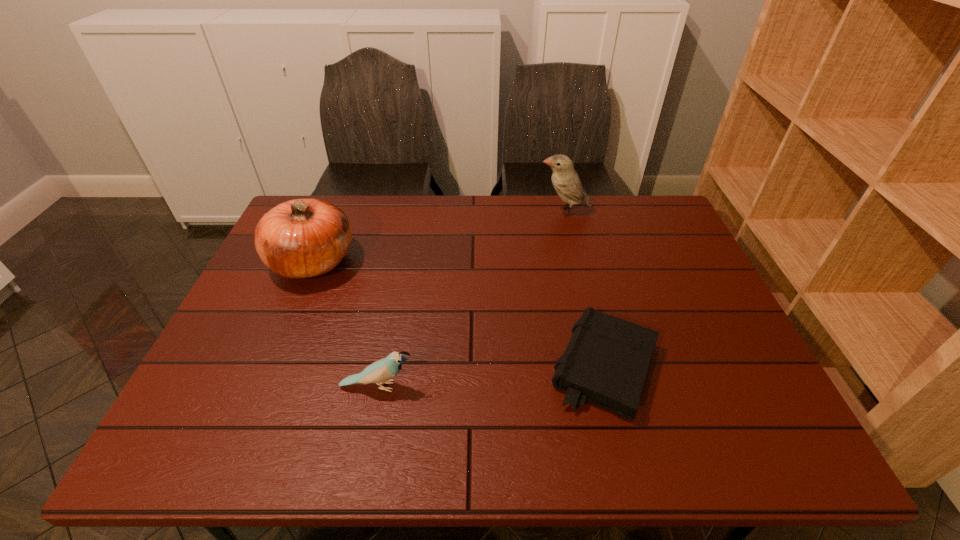
You are a GUI agent. You are given a task and a screenshot of the screen. Output one action in this format:
    pyautogui.click(x=<x>, y=<y>)
    Task: Click on the farthest object
    The height and width of the screenshot is (540, 960).
    Given the screenshot: What is the action you would take?
    pyautogui.click(x=565, y=180)

Locate an element on the screen. the taller bird is located at coordinates (565, 180).

Locate an element on the screen. pumpkin is located at coordinates (301, 238).

Locate an element on the screen. The width and height of the screenshot is (960, 540). the leftmost object is located at coordinates (301, 238).

The image size is (960, 540). Find the location of `the left bird`. the left bird is located at coordinates (380, 372).

Identify the location of the shorter bird. The image size is (960, 540). (380, 372).

Find the location of a particular element. The width and height of the screenshot is (960, 540). Bible is located at coordinates (605, 363).

At what (x,y) coordinates should I click in order to perform the action: click on vacant area situated 0.170m at the face of the farther bird. Please return your answer as a coordinate pair (x, y). Looking at the image, I should click on (488, 211).

Identify the location of vacant position located at the face of the farther bird. This screenshot has width=960, height=540. (472, 211).

This screenshot has height=540, width=960. In order to click on blank space located at the face of the farther bird in this screenshot , I will do `click(428, 211)`.